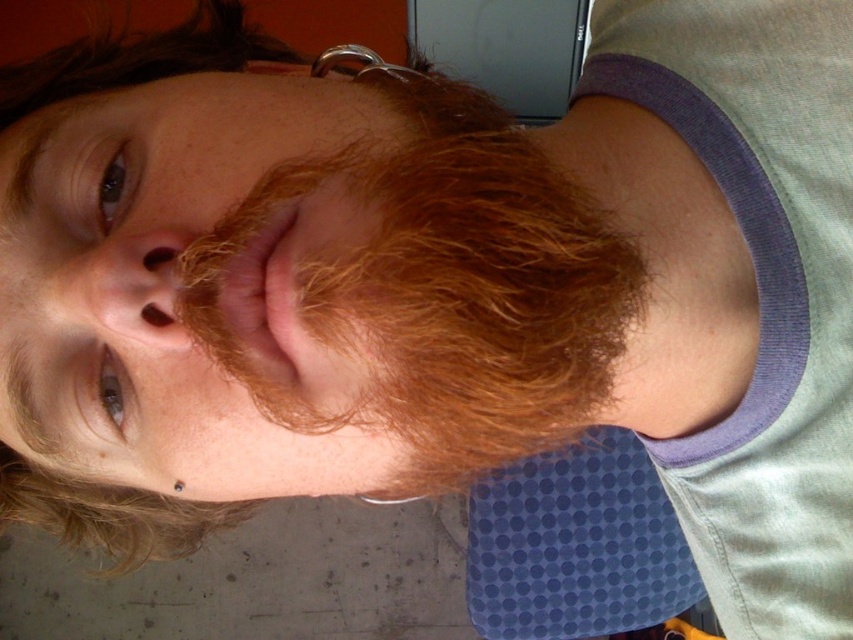
Question: Does fluffy reddish-brown beard at center come behind purple fabric shirt at upper center?

Choices:
 (A) yes
 (B) no

Answer: (B)

Question: Does fluffy reddish-brown beard at center have a larger size compared to purple fabric shirt at upper center?

Choices:
 (A) no
 (B) yes

Answer: (A)

Question: Is fluffy reddish-brown beard at center thinner than purple fabric shirt at upper center?

Choices:
 (A) no
 (B) yes

Answer: (A)

Question: Among these points, which one is farthest from the camera?

Choices:
 (A) (723, 595)
 (B) (500, 189)

Answer: (A)